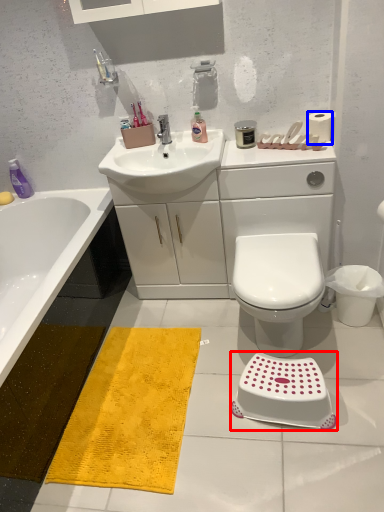
Question: Which of the following is the farthest to the observer, step stool (highlighted by a red box) or toilet paper (highlighted by a blue box)?

Choices:
 (A) step stool
 (B) toilet paper

Answer: (B)